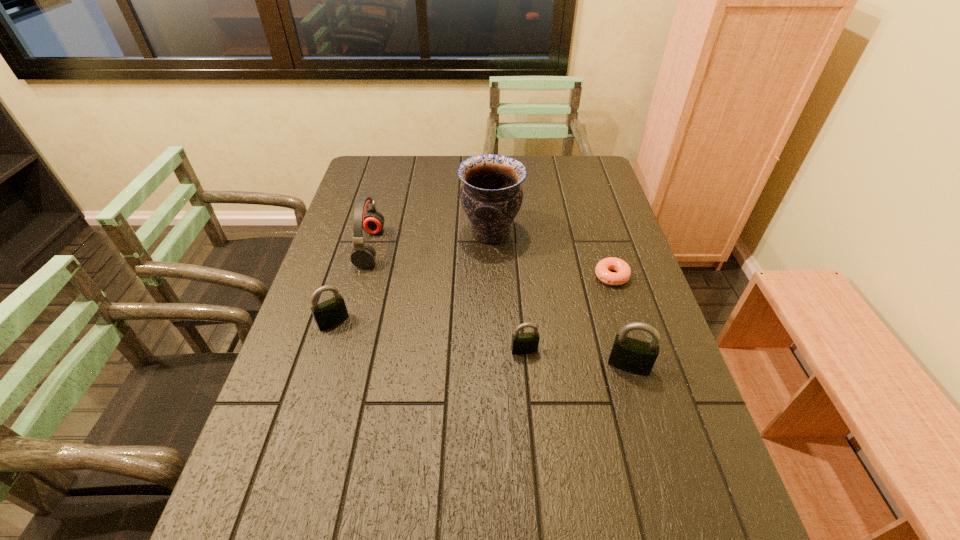
Locate which padlock is the closest to the tallest object. Please provide its 2D coordinates. Your answer should be formatted as a tuple, i.e. [(x, y)], where the tuple contains the x and y coordinates of a point satisfying the conditions above.

[(522, 343)]

Find the location of a particular element. vacant space that satisfies the following two spatial constraints: 1. on the front handle of the shortest object; 2. on the left side of the tallest object is located at coordinates (492, 276).

Locate an element on the screen. The image size is (960, 540). free location that satisfies the following two spatial constraints: 1. on the front handle of the tallest object; 2. on the right side of the rightmost padlock is located at coordinates (494, 366).

Where is `vacant space that satisfies the following two spatial constraints: 1. on the front side of the tallest padlock; 2. on the right side of the second tallest padlock`? vacant space that satisfies the following two spatial constraints: 1. on the front side of the tallest padlock; 2. on the right side of the second tallest padlock is located at coordinates pyautogui.click(x=320, y=366).

The height and width of the screenshot is (540, 960). What are the coordinates of `vacant space that satisfies the following two spatial constraints: 1. on the front handle of the tallest object; 2. on the front side of the farthest padlock` in the screenshot? It's located at (493, 321).

You are a GUI agent. You are given a task and a screenshot of the screen. Output one action in this format:
    pyautogui.click(x=<x>, y=<y>)
    Task: Click on the vacant space that satisfies the following two spatial constraints: 1. on the ear cups of the shortest padlock; 2. on the right side of the earphone
    Image resolution: width=960 pixels, height=540 pixels.
    Given the screenshot: What is the action you would take?
    pyautogui.click(x=342, y=350)

Where is `free space that satisfies the following two spatial constraints: 1. on the ear cups of the tallest padlock; 2. on the left side of the earphone`? Image resolution: width=960 pixels, height=540 pixels. free space that satisfies the following two spatial constraints: 1. on the ear cups of the tallest padlock; 2. on the left side of the earphone is located at coordinates (338, 366).